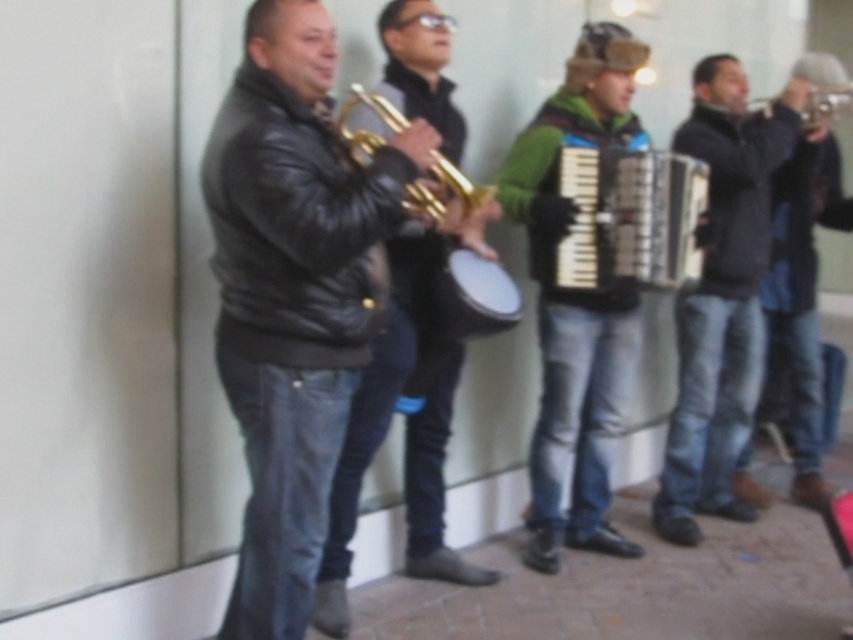
Question: Can you confirm if black leather jacket at left is thinner than dark blue jeans at center?

Choices:
 (A) yes
 (B) no

Answer: (A)

Question: Estimate the real-world distances between objects in this image. Which object is closer to the dark blue jeans at center?

Choices:
 (A) black leather jacket at left
 (B) gold shiny trumpet at upper center
 (C) dark brown leather jacket at right
 (D) metallic silver accordion at center

Answer: (C)

Question: Based on their relative distances, which object is nearer to the dark brown leather jacket at right?

Choices:
 (A) black leather jacket at left
 (B) metallic silver accordion at center
 (C) shiny gold trumpet at center
 (D) gold shiny trumpet at upper center

Answer: (D)

Question: Is dark blue jeans at center above dark brown leather jacket at right?

Choices:
 (A) no
 (B) yes

Answer: (A)

Question: Can you confirm if dark blue jeans at center is positioned to the right of dark brown leather jacket at right?

Choices:
 (A) no
 (B) yes

Answer: (A)

Question: Which object is positioned farthest from the shiny gold trumpet at center?

Choices:
 (A) dark brown leather jacket at right
 (B) gold shiny trumpet at center
 (C) gold shiny trumpet at upper center
 (D) metallic silver accordion at center

Answer: (A)